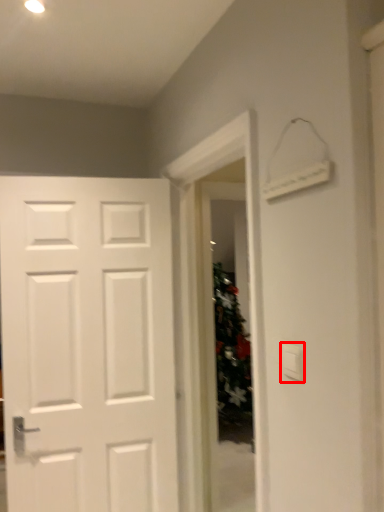
Question: From the image's perspective, where is light switch (annotated by the red box) located relative to glass door?

Choices:
 (A) below
 (B) above

Answer: (B)